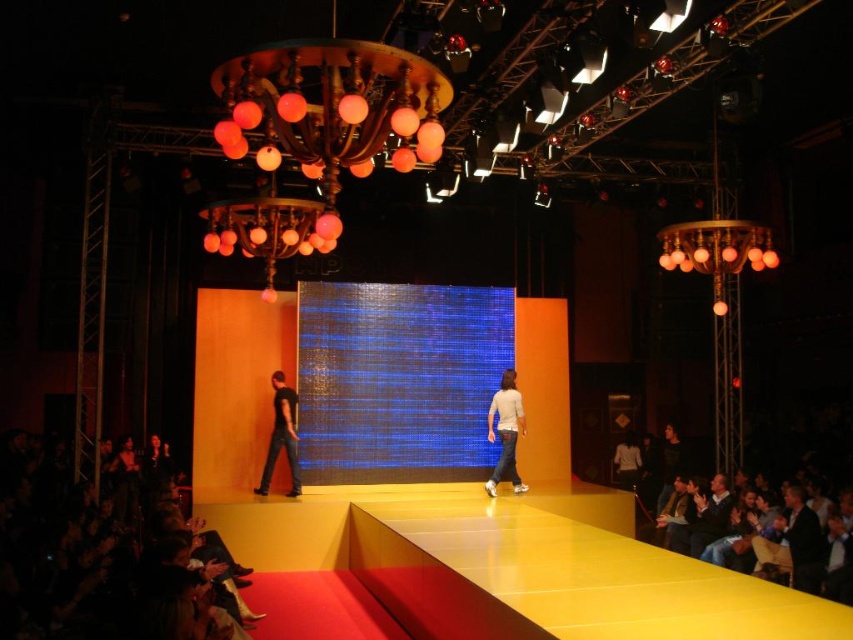
Question: Which object appears closest to the camera in this image?

Choices:
 (A) matte orange glass chandelier at upper right
 (B) white matte sweater at center
 (C) dark suit at right
 (D) black matte jeans at lower left

Answer: (C)

Question: Can you confirm if matte gold chandelier at upper center is positioned below dark suit at right?

Choices:
 (A) yes
 (B) no

Answer: (B)

Question: Is matte gold chandelier at upper center thinner than white matte sweater at center?

Choices:
 (A) no
 (B) yes

Answer: (A)

Question: Among these objects, which one is farthest from the camera?

Choices:
 (A) white matte sweater at center
 (B) dark blue shirt at lower right
 (C) matte orange glass chandelier at upper right
 (D) black matte jeans at lower left

Answer: (A)

Question: Does dark suit at right appear over black matte jeans at lower left?

Choices:
 (A) yes
 (B) no

Answer: (B)

Question: Which point is closer to the camera?

Choices:
 (A) (294, 467)
 (B) (717, 490)

Answer: (B)